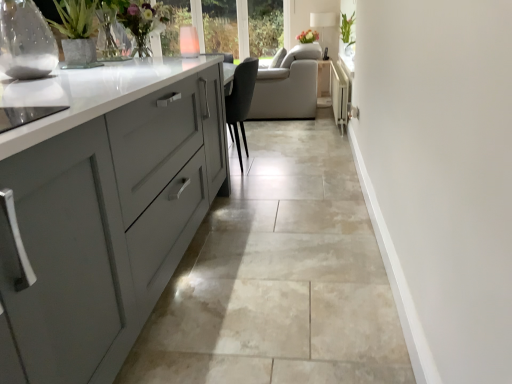
Question: Is green glossy plant at upper right inside or outside of white fabric lampshade at upper center?

Choices:
 (A) outside
 (B) inside

Answer: (A)

Question: Considering the positions of green glossy plant at upper right and white fabric lampshade at upper center in the image, is green glossy plant at upper right taller or shorter than white fabric lampshade at upper center?

Choices:
 (A) short
 (B) tall

Answer: (A)

Question: Which is farther from the green glossy plant at upper right?

Choices:
 (A) clear glass vase at upper left, positioned as the 1th glass vase in left-to-right order
 (B) beige tile floor at center
 (C) white fabric lampshade at upper center
 (D) translucent glass vase at upper left, the 1th floral arrangement in the front-to-back sequence
 (E) white matte floral arrangement at upper center, marked as the 2th floral arrangement in a front-to-back arrangement

Answer: (A)

Question: Considering the real-world distances, which object is closest to the white matte floral arrangement at upper center, arranged as the first floral arrangement when viewed from the back?

Choices:
 (A) white fabric lampshade at upper center
 (B) clear glass vase at center, which is the first glass vase from right to left
 (C) translucent glass vase at upper left, which ranks as the second floral arrangement in back-to-front order
 (D) beige tile floor at center
 (E) clear glass vase at upper left, the 1th glass vase ordered from the bottom

Answer: (A)